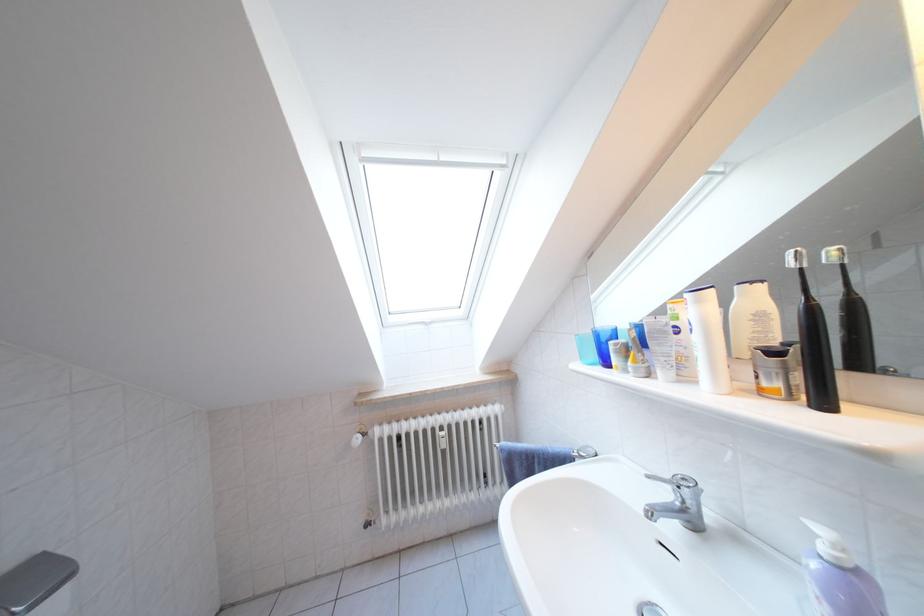
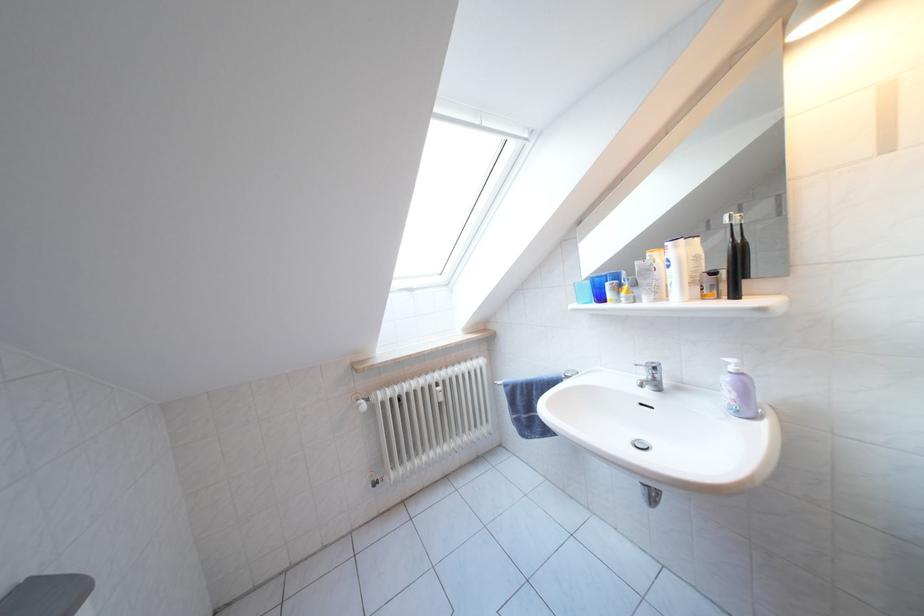
Question: Which direction would the cameraman need to move to produce the second image? Reply with the corresponding letter.

Choices:
 (A) Left
 (B) Right
 (C) Forward
 (D) Backward

Answer: (A)